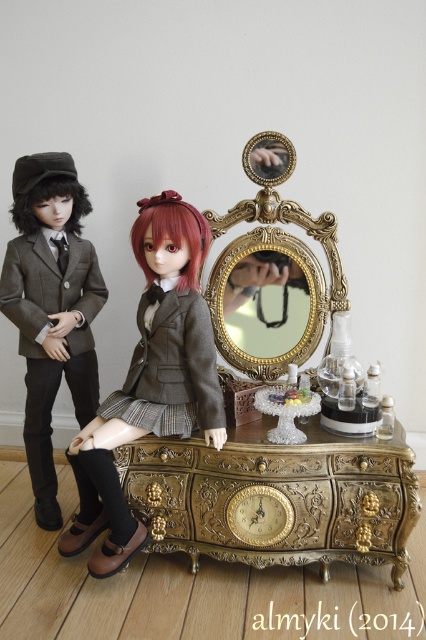
In the scene shown: You are a tailor measuring for a suit. You see the matte brown suit at left and the gold ornate mirror at center. Which object is taller?

The matte brown suit at left is much taller than the gold ornate mirror at center.

Based on the photo, you are a toy organizer trying to place a small 3 inch tall accessory between the gold ornate drawer at center and the matte gray fabric doll at center. Is there enough space for the accessory to fit without overlapping either object?

The gold ornate drawer at center is 11.59 inches from the matte gray fabric doll at center. Since the accessory is only 3 inches tall, there is sufficient space between them to place it without overlapping either object.

You are a photographer setting up a camera to capture the two dolls on the dressing table. The camera is positioned to focus on the point labeled point (65,182) and point (276,241). Which point should you adjust the focus distance for first to ensure both points are in sharp focus?

Since point (65,182) is closer to the viewer than point (276,241), you should first focus on point (65,182). This ensures that the closer point is in focus, and then adjust for the farther point to achieve sharpness for both.